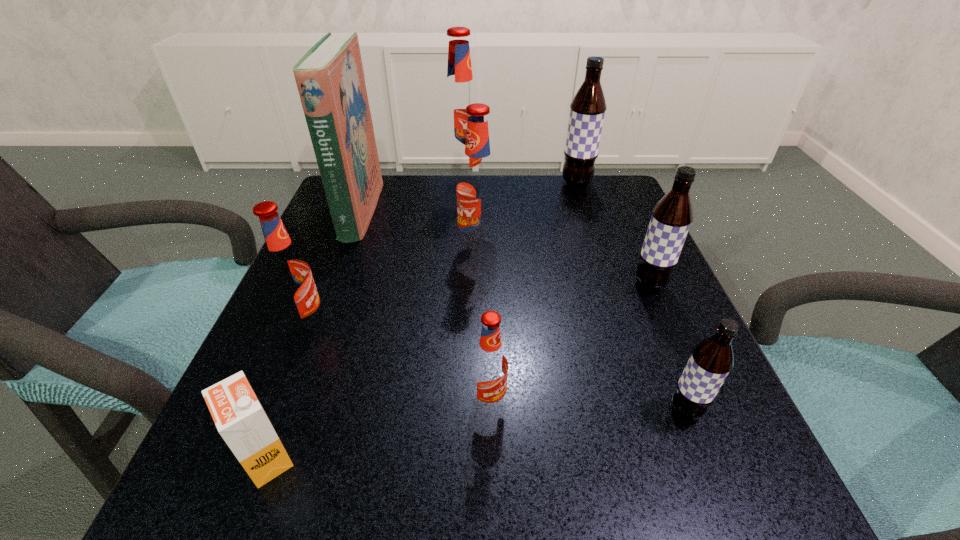
This screenshot has height=540, width=960. Find the location of `object that is at the far right corner`. object that is at the far right corner is located at coordinates (587, 110).

You are a GUI agent. You are given a task and a screenshot of the screen. Output one action in this format:
    pyautogui.click(x=<x>, y=<y>)
    Task: Click on the vacant region at the far edge of the desktop
    This screenshot has width=960, height=540.
    Given the screenshot: What is the action you would take?
    pyautogui.click(x=542, y=205)

Locate an element on the screen. The width and height of the screenshot is (960, 540). vacant area at the left edge of the desktop is located at coordinates (332, 272).

Find the location of a particular element. This screenshot has height=540, width=960. free location at the right edge of the desktop is located at coordinates (661, 332).

Identify the location of free space at the far right corner. (598, 186).

The image size is (960, 540). Find the location of `empty space between the second nearest red root beer and the shortest object`. empty space between the second nearest red root beer and the shortest object is located at coordinates coord(287,391).

Where is `empty location between the tallest root beer and the hardback book`? This screenshot has height=540, width=960. empty location between the tallest root beer and the hardback book is located at coordinates (412, 198).

Where is `unoccupied position between the hardback book and the shortest object`? Image resolution: width=960 pixels, height=540 pixels. unoccupied position between the hardback book and the shortest object is located at coordinates point(314,334).

Locate an element on the screen. empty location between the hardback book and the fifth nearest root beer is located at coordinates (420, 230).

Locate an element on the screen. Image resolution: width=960 pixels, height=540 pixels. vacant space that's between the hardback book and the fifth nearest root beer is located at coordinates (420, 230).